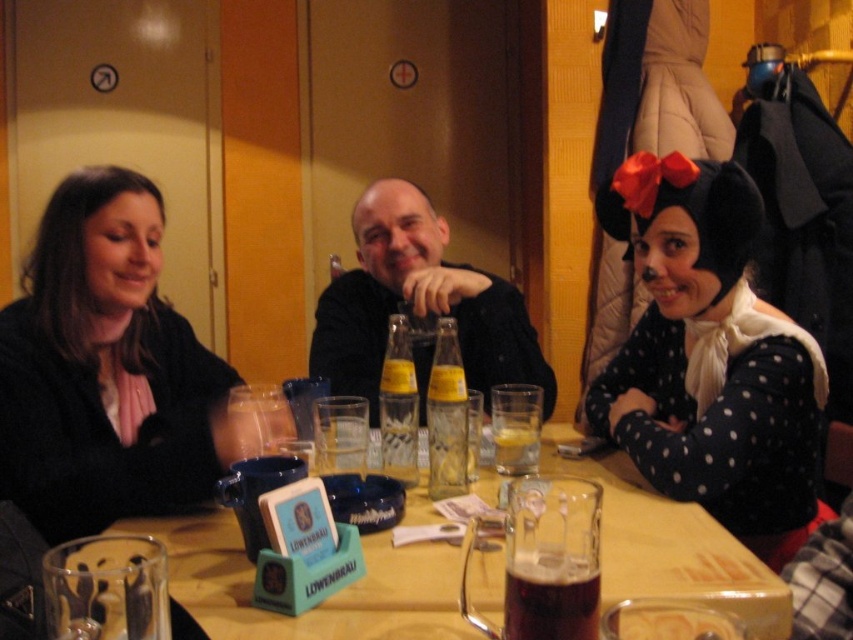
Between black felt hat at upper right and dark amber glass at table center, which one has more height?

black felt hat at upper right is taller.

Which is below, black felt hat at upper right or dark amber glass at table center?

dark amber glass at table center is lower down.

What do you see at coordinates (711, 358) in the screenshot? Image resolution: width=853 pixels, height=640 pixels. I see `black felt hat at upper right` at bounding box center [711, 358].

Locate an element on the screen. The height and width of the screenshot is (640, 853). black felt hat at upper right is located at coordinates (711, 358).

Is black felt hat at upper right to the right of translucent glass beer at table center from the viewer's perspective?

Correct, you'll find black felt hat at upper right to the right of translucent glass beer at table center.

Locate an element on the screen. black felt hat at upper right is located at coordinates (711, 358).

What do you see at coordinates (103, 369) in the screenshot?
I see `matte black sweater at left` at bounding box center [103, 369].

Does point (12, 321) come in front of point (519, 451)?

No, (12, 321) is further to viewer.

The width and height of the screenshot is (853, 640). Describe the element at coordinates (103, 369) in the screenshot. I see `matte black sweater at left` at that location.

Find the location of a particular element. matte black sweater at left is located at coordinates tap(103, 369).